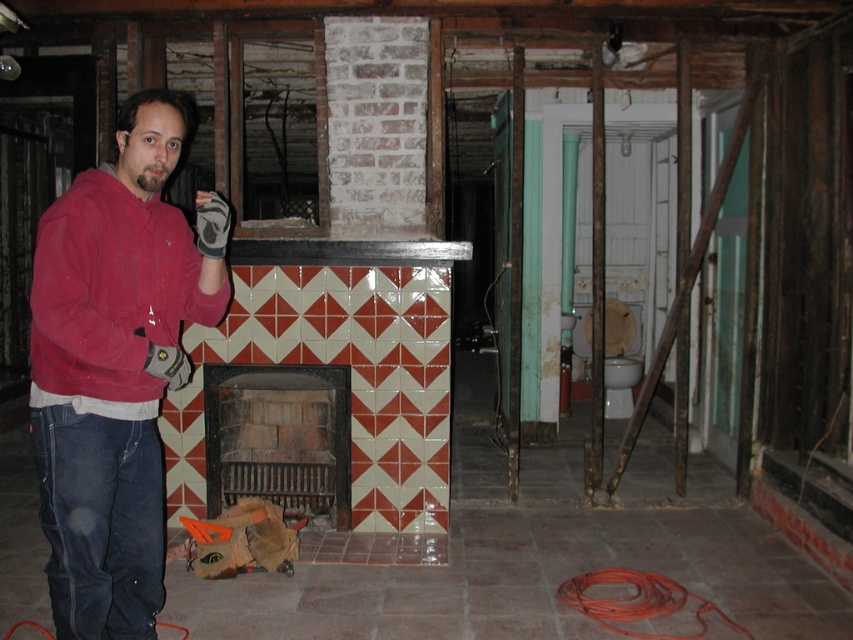
You are a contractor assessing the space. You see the matte red hoodie at left and the red brick fireplace at center. Which object takes up more visual space in the image?

The matte red hoodie at left is larger in size than the red brick fireplace at center, so it takes up more visual space in the image.

You are a construction worker who needs to locate your matte red hoodie at left. Based on the coordinates provided, where should you look in the image?

The matte red hoodie at left is located at point coordinates 0.573 on the x axis and 0.136 on the y axis.